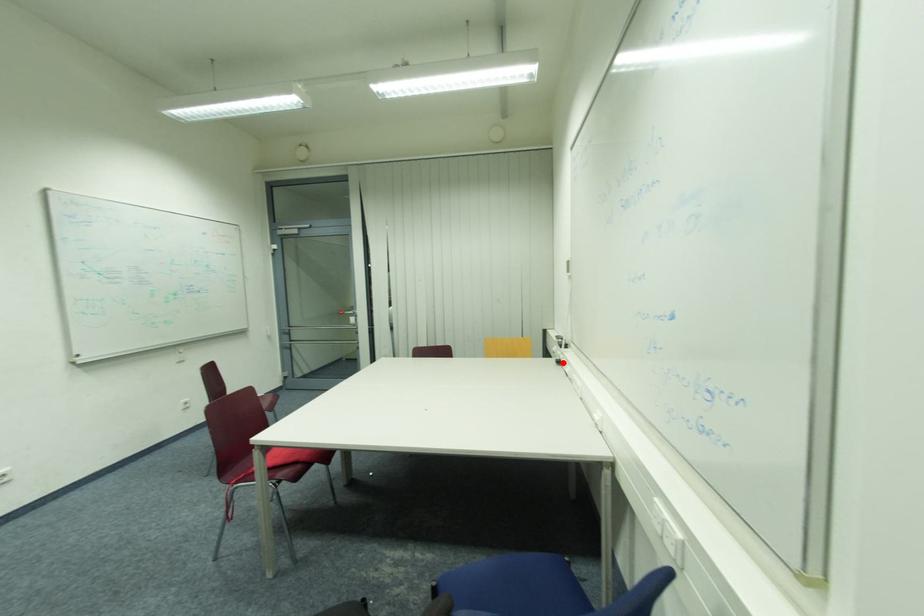
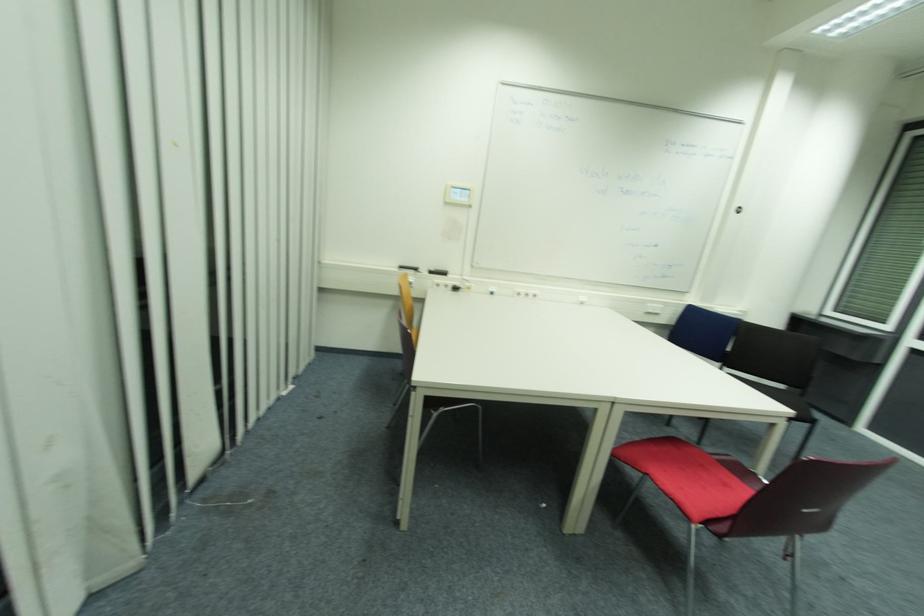
Locate, in the second image, the point that corresponds to the highlighted location in the first image.

(458, 290)